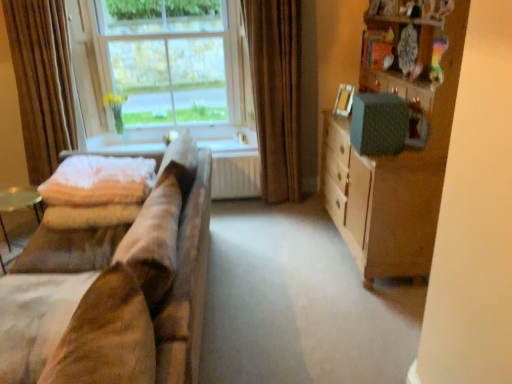
You are a GUI agent. You are given a task and a screenshot of the screen. Output one action in this format:
    pyautogui.click(x=<x>, y=<y>)
    Task: Click on the clear glass window at upper left
    
    Given the screenshot: What is the action you would take?
    pyautogui.click(x=160, y=66)

In the scene shown: What is the approximate width of clear glass window at upper left?

clear glass window at upper left is 6.54 inches in width.

Describe the element at coordinates (276, 93) in the screenshot. I see `brown velvet curtain at center, which ranks as the 1th curtain in right-to-left order` at that location.

What is the approximate width of soft pink quilt at left?

soft pink quilt at left is 20.76 inches in width.

Locate an element on the screen. This screenshot has height=384, width=512. wooden cabinet at right is located at coordinates (400, 137).

The width and height of the screenshot is (512, 384). I want to click on clear glass window at upper left, so click(160, 66).

From a real-world perspective, between wooden cabinet at right and brown velvet curtain at center, arranged as the 2th curtain when viewed from the left, who is vertically lower?

wooden cabinet at right is physically lower.

From the image's perspective, is wooden cabinet at right positioned above or below brown velvet curtain at center, arranged as the 2th curtain when viewed from the left?

Based on their image positions, wooden cabinet at right is located beneath brown velvet curtain at center, arranged as the 2th curtain when viewed from the left.

Considering their positions, is wooden cabinet at right located in front of or behind brown velvet curtain at center, arranged as the 2th curtain when viewed from the left?

Visually, wooden cabinet at right is located in front of brown velvet curtain at center, arranged as the 2th curtain when viewed from the left.

Considering the relative sizes of wooden cabinet at right and brown velvet curtain at center, arranged as the 2th curtain when viewed from the left, in the image provided, is wooden cabinet at right taller than brown velvet curtain at center, arranged as the 2th curtain when viewed from the left,?

No, wooden cabinet at right is not taller than brown velvet curtain at center, arranged as the 2th curtain when viewed from the left.

Can you tell me how much wooden cabinet at right and suede-like beige couch at left differ in facing direction?

Answer: They differ by 0.808 degrees in their facing directions.

Could you tell me if wooden cabinet at right is facing suede-like beige couch at left?

Yes, wooden cabinet at right is oriented towards suede-like beige couch at left.

Which object is wider, wooden cabinet at right or suede-like beige couch at left?

Wider between the two is suede-like beige couch at left.

Is point (325, 145) positioned behind point (137, 305)?

Yes.

Is the position of clear glass window at upper left less distant than that of soft pink quilt at left?

No, clear glass window at upper left is further to the viewer.

Is clear glass window at upper left thinner than soft pink quilt at left?

Yes.

Is clear glass window at upper left next to soft pink quilt at left?

No.

Is wooden cabinet at right taller or shorter than white fabric at lower left?

Clearly, wooden cabinet at right is taller compared to white fabric at lower left.

Is wooden cabinet at right completely or partially outside of white fabric at lower left?

Yes.

Measure the distance from wooden cabinet at right to white fabric at lower left.

wooden cabinet at right and white fabric at lower left are 1.47 meters apart.

From a real-world perspective, is wooden cabinet at right under white fabric at lower left?

No, from a real-world perspective, wooden cabinet at right is not under white fabric at lower left.

Is brown velvet curtain at center, arranged as the 2th curtain when viewed from the left, positioned far away from wooden cabinet at right?

brown velvet curtain at center, arranged as the 2th curtain when viewed from the left, is near wooden cabinet at right, not far away.

Is brown velvet curtain at center, which ranks as the 1th curtain in right-to-left order, oriented away from wooden cabinet at right?

brown velvet curtain at center, which ranks as the 1th curtain in right-to-left order, does not have its back to wooden cabinet at right.

In the scene shown: Between brown velvet curtain at center, arranged as the 2th curtain when viewed from the left, and wooden cabinet at right, which one appears on the left side from the viewer's perspective?

Positioned to the left is brown velvet curtain at center, arranged as the 2th curtain when viewed from the left.

From a real-world perspective, is brown velvet curtain at center, which ranks as the 1th curtain in right-to-left order, under wooden cabinet at right?

No, from a real-world perspective, brown velvet curtain at center, which ranks as the 1th curtain in right-to-left order, is not under wooden cabinet at right.

How different are the orientations of clear glass window at upper left and suede-like beige couch at left in degrees?

clear glass window at upper left and suede-like beige couch at left are facing 91.1 degrees away from each other.

From the image's perspective, which is above, clear glass window at upper left or suede-like beige couch at left?

clear glass window at upper left, from the image's perspective.

Considering the positions of objects clear glass window at upper left and suede-like beige couch at left in the image provided, who is in front, clear glass window at upper left or suede-like beige couch at left?

Positioned in front is suede-like beige couch at left.

Does point (211, 41) lie in front of point (174, 302)?

That is False.

Is white fabric at lower left facing towards suede-like beige couch at left?

Yes, white fabric at lower left is oriented towards suede-like beige couch at left.

Is white fabric at lower left bigger than suede-like beige couch at left?

No, white fabric at lower left is not bigger than suede-like beige couch at left.

Considering the positions of points (91, 145) and (29, 286), is point (91, 145) farther from camera compared to point (29, 286)?

That is True.

Does white fabric at lower left appear on the right side of suede-like beige couch at left?

Correct, you'll find white fabric at lower left to the right of suede-like beige couch at left.

Where is `cabinetry below the brown velvet curtain at center, which ranks as the 1th curtain in right-to-left order (from a real-world perspective)`? Image resolution: width=512 pixels, height=384 pixels. cabinetry below the brown velvet curtain at center, which ranks as the 1th curtain in right-to-left order (from a real-world perspective) is located at coordinates (400, 137).

Find the location of a particular element. The width and height of the screenshot is (512, 384). studio couch in front of the wooden cabinet at right is located at coordinates (120, 296).

Looking at the image, which one is located closer to suede-like beige couch at left, white fabric at lower left or soft pink quilt at left?

soft pink quilt at left is closer to suede-like beige couch at left.

Considering their positions, is clear glass window at upper left positioned further to wooden cabinet at right than soft pink quilt at left?

clear glass window at upper left is positioned further to the anchor wooden cabinet at right.

Considering their positions, is clear glass window at upper left positioned further to wooden cabinet at right than suede-like beige couch at left?

The object further to wooden cabinet at right is clear glass window at upper left.

Considering their positions, is suede-like beige couch at left positioned further to wooden cabinet at right than brown velvet curtain at center, arranged as the 2th curtain when viewed from the left?

suede-like beige couch at left is further to wooden cabinet at right.

Based on the photo, when comparing their distances from wooden cabinet at right, does clear glass window at upper left or white fabric at lower left seem closer?

white fabric at lower left is positioned closer to the anchor wooden cabinet at right.

From the image, which object appears to be farther from beige fabric curtain at left, acting as the first curtain starting from the left, white fabric at lower left or brown velvet curtain at center, which ranks as the 1th curtain in right-to-left order?

Based on the image, brown velvet curtain at center, which ranks as the 1th curtain in right-to-left order, appears to be further to beige fabric curtain at left, acting as the first curtain starting from the left.

Which object lies nearer to the anchor point soft pink quilt at left, white fabric at lower left or brown velvet curtain at center, which ranks as the 1th curtain in right-to-left order?

white fabric at lower left is closer to soft pink quilt at left.

Which object lies further to the anchor point wooden cabinet at right, brown velvet curtain at center, arranged as the 2th curtain when viewed from the left, or suede-like beige couch at left?

suede-like beige couch at left lies further to wooden cabinet at right than the other object.

Identify the location of quilt positioned between suede-like beige couch at left and brown velvet curtain at center, arranged as the 2th curtain when viewed from the left, from near to far. The height and width of the screenshot is (384, 512). (99, 181).

Find the location of a particular element. The width and height of the screenshot is (512, 384). quilt located between suede-like beige couch at left and beige fabric curtain at left, acting as the first curtain starting from the left, in the depth direction is located at coordinates (99, 181).

Identify the location of cabinetry between suede-like beige couch at left and white fabric at lower left along the z-axis. (400, 137).

Image resolution: width=512 pixels, height=384 pixels. Find the location of `window between beige fabric curtain at left, acting as the first curtain starting from the left, and brown velvet curtain at center, arranged as the 2th curtain when viewed from the left`. window between beige fabric curtain at left, acting as the first curtain starting from the left, and brown velvet curtain at center, arranged as the 2th curtain when viewed from the left is located at coordinates (160, 66).